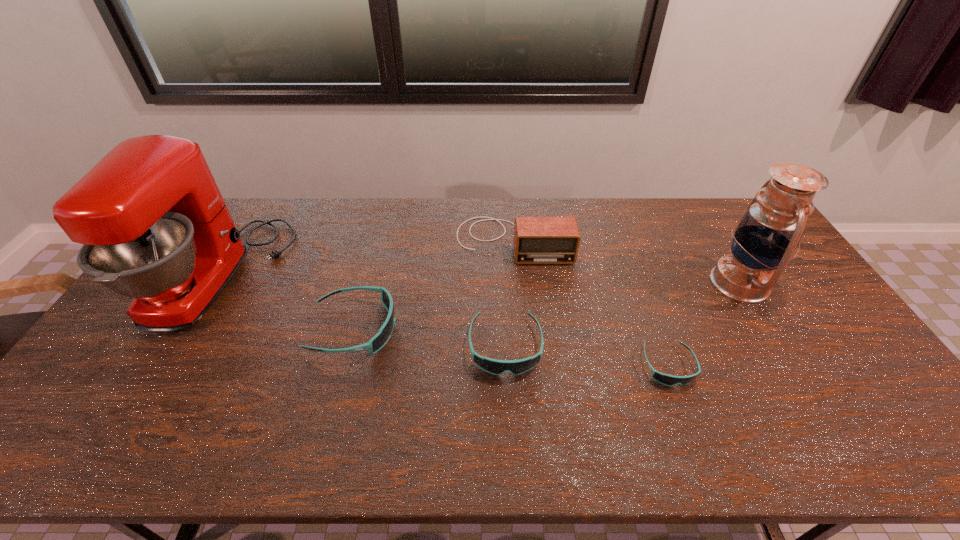
This screenshot has width=960, height=540. Identify the location of the fifth object from right to left. (381, 338).

The image size is (960, 540). Identify the location of the second tallest sunglasses. (497, 367).

The width and height of the screenshot is (960, 540). Identify the location of the second sunglasses from right to left. (497, 367).

This screenshot has height=540, width=960. Identify the location of the shortest object. (669, 380).

Image resolution: width=960 pixels, height=540 pixels. I want to click on the shortest sunglasses, so click(x=669, y=380).

The width and height of the screenshot is (960, 540). In order to click on the rightmost object in this screenshot , I will do `click(771, 229)`.

Identify the location of kitchen mixer. The height and width of the screenshot is (540, 960). (155, 227).

This screenshot has height=540, width=960. What are the coordinates of `radio receiver` in the screenshot? It's located at (537, 240).

This screenshot has width=960, height=540. What are the coordinates of `blank space located 0.070m on the front-facing side of the leftmost sunglasses` in the screenshot? It's located at (422, 329).

The height and width of the screenshot is (540, 960). In order to click on free space located 0.060m on the front-facing side of the second sunglasses from left to right in this screenshot , I will do `click(508, 401)`.